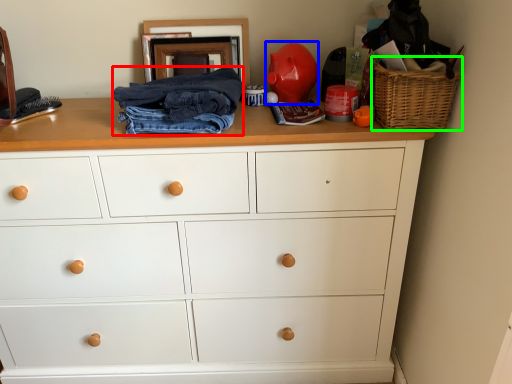
Question: Considering the real-world distances, which object is farthest from clothing (highlighted by a red box)? toy (highlighted by a blue box) or basket (highlighted by a green box)?

Choices:
 (A) toy
 (B) basket

Answer: (B)